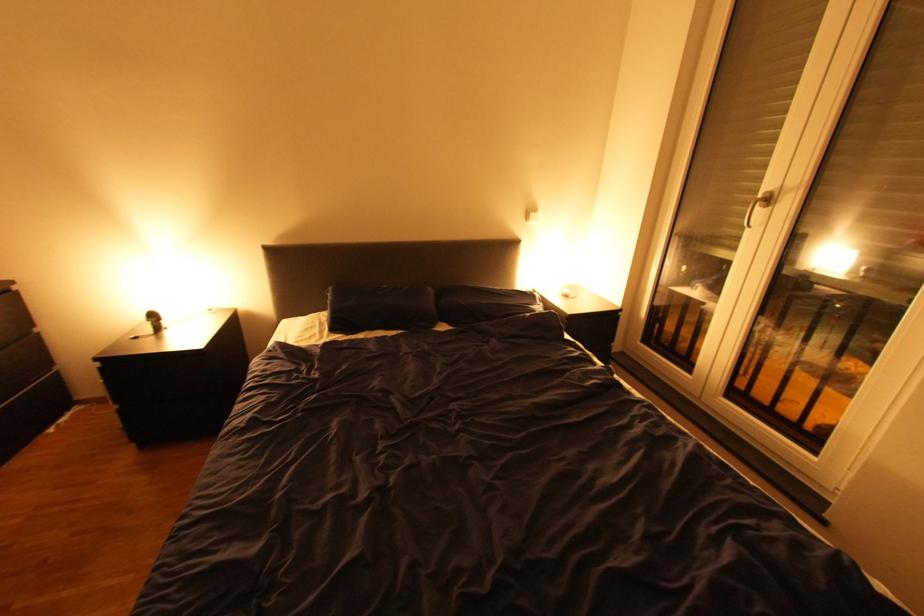
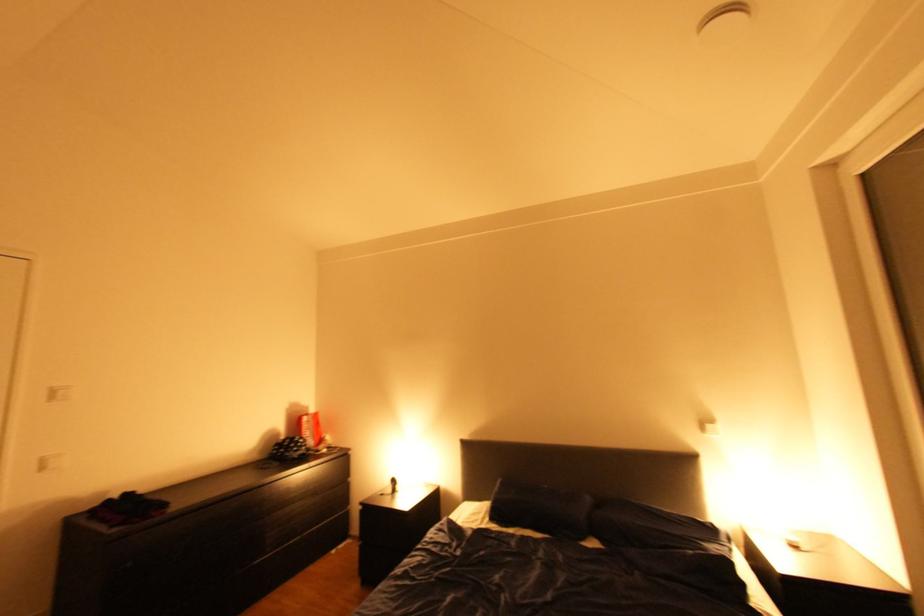
Looking at this image, first-person continuous shooting, in which direction is the camera rotating?

The camera's rotation is toward left-up.